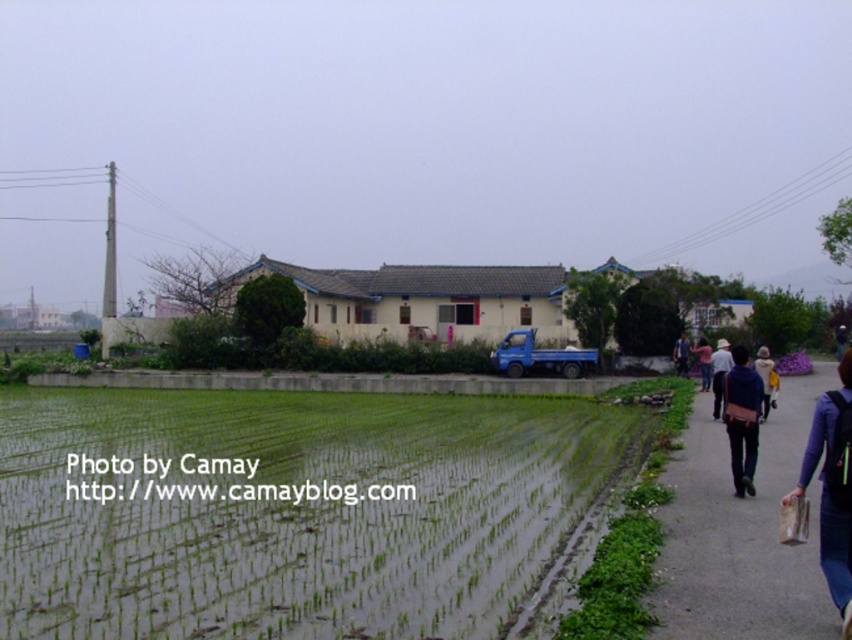
Looking at this image, you are standing in the rural scene and notice two items at the right side of the image. Which item is positioned further to the right between the pink fabric at right and the dark blue jacket at right?

The pink fabric at right is positioned further to the right compared to the dark blue jacket at right.